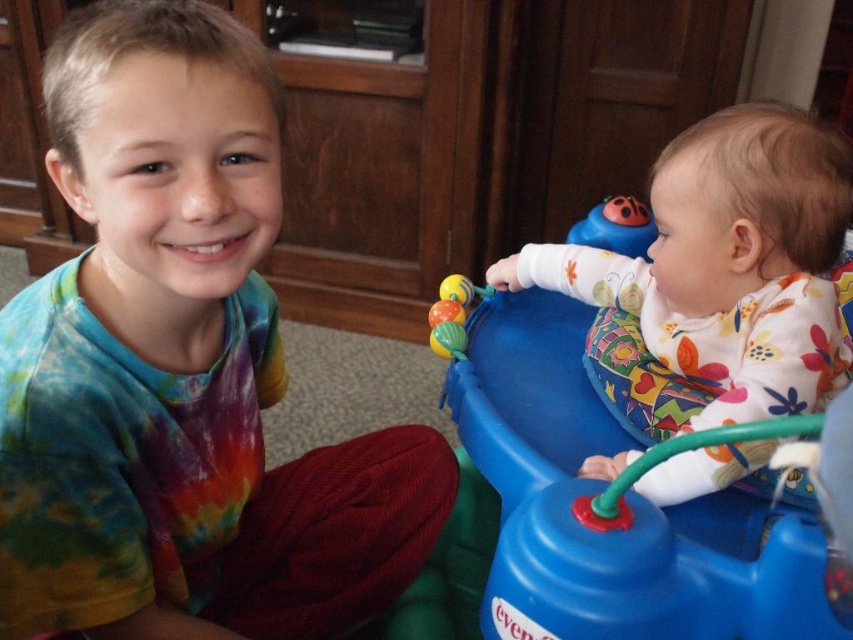
Question: Estimate the real-world distances between objects in this image. Which object is closer to the rubberized multicolored balls at center?

Choices:
 (A) tie-dye fabric shirt at left
 (B) matte plastic toy at upper right

Answer: (B)

Question: Which of these objects is positioned farthest from the matte plastic toy at upper right?

Choices:
 (A) floral cotton baby at right
 (B) rubberized multicolored balls at center
 (C) tie-dye fabric shirt at left

Answer: (C)

Question: Does floral cotton baby at right have a greater width compared to matte plastic toy at upper right?

Choices:
 (A) yes
 (B) no

Answer: (A)

Question: Does tie-dye fabric shirt at left have a greater width compared to rubberized multicolored balls at center?

Choices:
 (A) no
 (B) yes

Answer: (B)

Question: Among these objects, which one is farthest from the camera?

Choices:
 (A) floral cotton baby at right
 (B) rubberized multicolored balls at center
 (C) matte plastic toy at upper right
 (D) tie-dye fabric shirt at left

Answer: (C)

Question: Is floral cotton baby at right closer to camera compared to matte plastic toy at upper right?

Choices:
 (A) yes
 (B) no

Answer: (A)